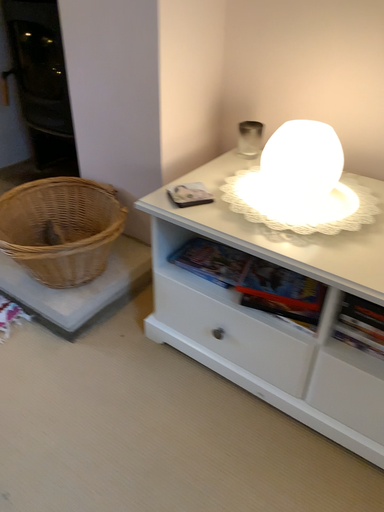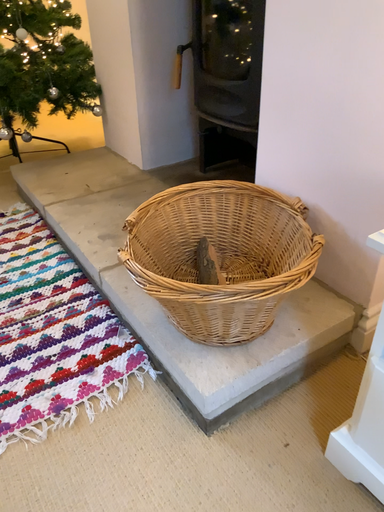
Question: Which way did the camera rotate in the video?

Choices:
 (A) rotated right
 (B) rotated left

Answer: (B)